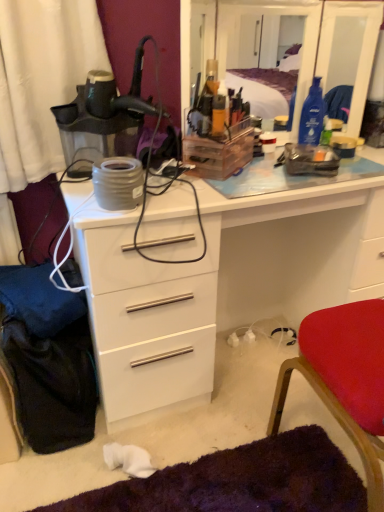
Question: Does red fabric chair at lower right have a lesser width compared to transparent plastic mirror at upper center?

Choices:
 (A) no
 (B) yes

Answer: (A)

Question: Does red fabric chair at lower right come behind transparent plastic mirror at upper center?

Choices:
 (A) no
 (B) yes

Answer: (A)

Question: From the image's perspective, is red fabric chair at lower right located above transparent plastic mirror at upper center?

Choices:
 (A) no
 (B) yes

Answer: (A)

Question: Is red fabric chair at lower right directly adjacent to transparent plastic mirror at upper center?

Choices:
 (A) yes
 (B) no

Answer: (B)

Question: From the image's perspective, is red fabric chair at lower right located beneath transparent plastic mirror at upper center?

Choices:
 (A) yes
 (B) no

Answer: (A)

Question: Is point (362, 115) closer or farther from the camera than point (248, 310)?

Choices:
 (A) closer
 (B) farther

Answer: (A)

Question: Would you say transparent plastic mirror at upper center is to the left or to the right of white glossy chest of drawers at center in the picture?

Choices:
 (A) left
 (B) right

Answer: (B)

Question: From their relative heights in the image, would you say transparent plastic mirror at upper center is taller or shorter than white glossy chest of drawers at center?

Choices:
 (A) tall
 (B) short

Answer: (B)

Question: Is transparent plastic mirror at upper center inside the boundaries of white glossy chest of drawers at center, or outside?

Choices:
 (A) inside
 (B) outside

Answer: (B)

Question: In terms of width, does white glossy chest of drawers at center look wider or thinner when compared to transparent plastic mirror at upper center?

Choices:
 (A) thin
 (B) wide

Answer: (B)

Question: From the image's perspective, is white glossy chest of drawers at center positioned above or below transparent plastic mirror at upper center?

Choices:
 (A) above
 (B) below

Answer: (B)

Question: Choose the correct answer: Is white glossy chest of drawers at center inside transparent plastic mirror at upper center or outside it?

Choices:
 (A) outside
 (B) inside

Answer: (A)

Question: Based on their sizes in the image, would you say white glossy chest of drawers at center is bigger or smaller than transparent plastic mirror at upper center?

Choices:
 (A) big
 (B) small

Answer: (A)

Question: Is white glossy chest of drawers at center situated inside red fabric chair at lower right or outside?

Choices:
 (A) inside
 (B) outside

Answer: (B)

Question: Considering the positions of white glossy chest of drawers at center and red fabric chair at lower right in the image, is white glossy chest of drawers at center taller or shorter than red fabric chair at lower right?

Choices:
 (A) tall
 (B) short

Answer: (B)